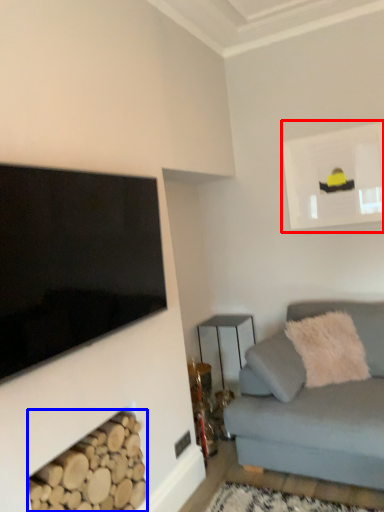
Question: Which object appears farthest to the camera in this image, picture frame (highlighted by a red box) or wood (highlighted by a blue box)?

Choices:
 (A) picture frame
 (B) wood

Answer: (A)